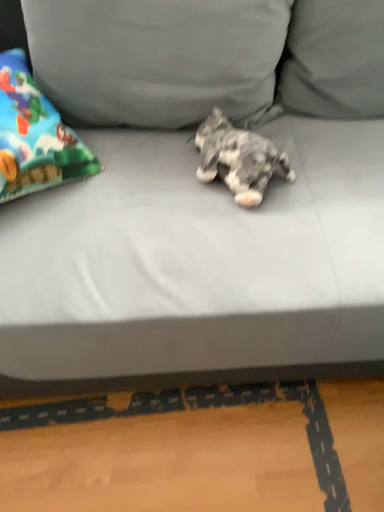
Question: From a real-world perspective, is gray fabric couch at center positioned under gray fabric pillow at upper center based on gravity?

Choices:
 (A) no
 (B) yes

Answer: (B)

Question: Considering the relative positions of gray fabric couch at center and gray fabric pillow at upper center in the image provided, is gray fabric couch at center behind gray fabric pillow at upper center?

Choices:
 (A) no
 (B) yes

Answer: (A)

Question: From the image's perspective, is gray fabric couch at center below gray fabric pillow at upper center?

Choices:
 (A) no
 (B) yes

Answer: (B)

Question: Is gray fabric couch at center facing towards gray fabric pillow at upper center?

Choices:
 (A) yes
 (B) no

Answer: (B)

Question: Is gray fabric pillow at upper center a part of gray fabric couch at center?

Choices:
 (A) yes
 (B) no

Answer: (A)

Question: Is gray fabric couch at center placed right next to gray fabric pillow at upper center?

Choices:
 (A) yes
 (B) no

Answer: (B)

Question: Considering the relative sizes of fluffy gray dog at center and gray fabric pillow at upper center in the image provided, is fluffy gray dog at center shorter than gray fabric pillow at upper center?

Choices:
 (A) yes
 (B) no

Answer: (A)

Question: Considering the relative sizes of fluffy gray dog at center and gray fabric pillow at upper center in the image provided, is fluffy gray dog at center smaller than gray fabric pillow at upper center?

Choices:
 (A) yes
 (B) no

Answer: (A)

Question: Is fluffy gray dog at center at the left side of gray fabric pillow at upper center?

Choices:
 (A) yes
 (B) no

Answer: (B)

Question: Does fluffy gray dog at center have a larger size compared to gray fabric pillow at upper center?

Choices:
 (A) yes
 (B) no

Answer: (B)

Question: Is fluffy gray dog at center taller than gray fabric pillow at upper center?

Choices:
 (A) no
 (B) yes

Answer: (A)

Question: From a real-world perspective, is fluffy gray dog at center below gray fabric pillow at upper center?

Choices:
 (A) yes
 (B) no

Answer: (A)

Question: Does gray fabric pillow at upper center lie behind gray fabric couch at center?

Choices:
 (A) no
 (B) yes

Answer: (B)